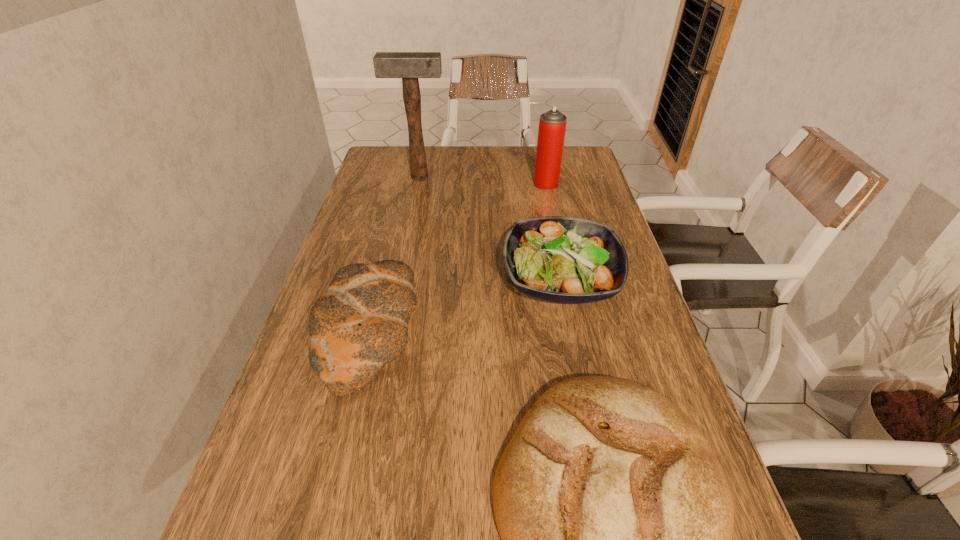
Find the location of `mallet situated at the left edge`. mallet situated at the left edge is located at coordinates (409, 66).

This screenshot has width=960, height=540. What are the coordinates of `bread present at the left edge` in the screenshot? It's located at (359, 325).

Locate an element on the screen. aerosol can that is at the right edge is located at coordinates (552, 125).

You are a GUI agent. You are given a task and a screenshot of the screen. Output one action in this format:
    pyautogui.click(x=<x>, y=<y>)
    Task: Click on the salad plate that is at the right edge
    
    Given the screenshot: What is the action you would take?
    pyautogui.click(x=557, y=259)

I want to click on object that is at the far left corner, so click(409, 66).

Where is `object located in the far right corner section of the desktop`? The width and height of the screenshot is (960, 540). object located in the far right corner section of the desktop is located at coordinates (552, 125).

In the image, there is a desktop. Where is `vacant space at the far edge`? Image resolution: width=960 pixels, height=540 pixels. vacant space at the far edge is located at coordinates (493, 155).

Find the location of `vacant space at the left edge`. vacant space at the left edge is located at coordinates (285, 475).

The width and height of the screenshot is (960, 540). I want to click on free space at the right edge of the desktop, so click(x=583, y=200).

Find the location of a particular element. Image resolution: width=960 pixels, height=540 pixels. free spot at the far right corner of the desktop is located at coordinates (583, 165).